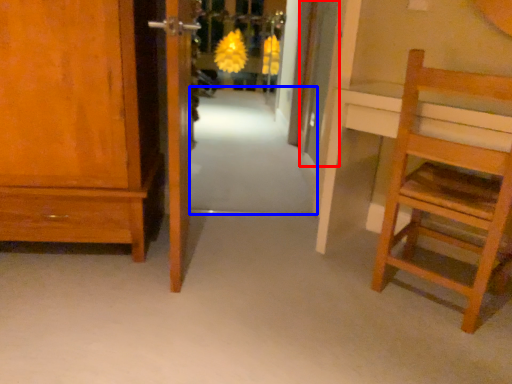
Question: Which object is further to the camera taking this photo, door (highlighted by a red box) or path (highlighted by a blue box)?

Choices:
 (A) door
 (B) path

Answer: (A)